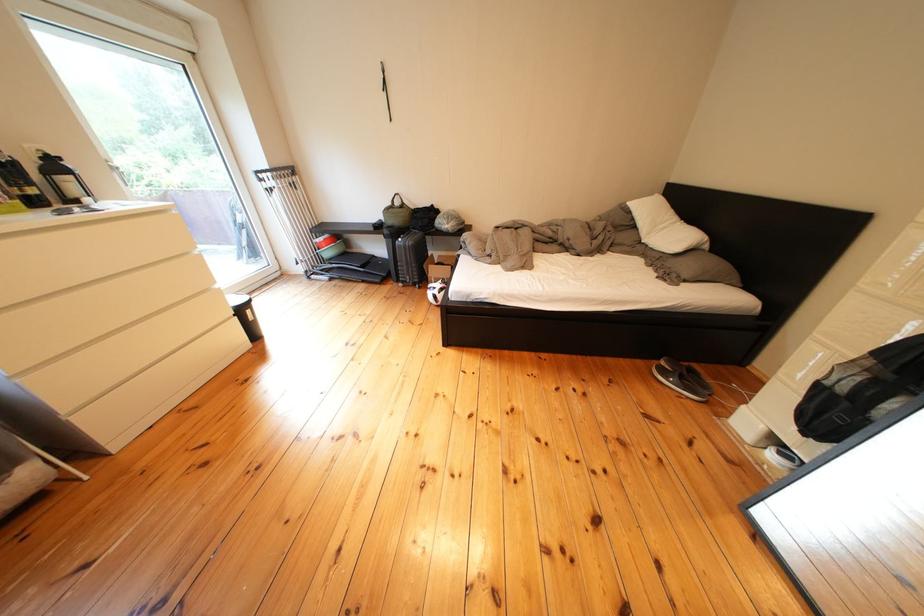
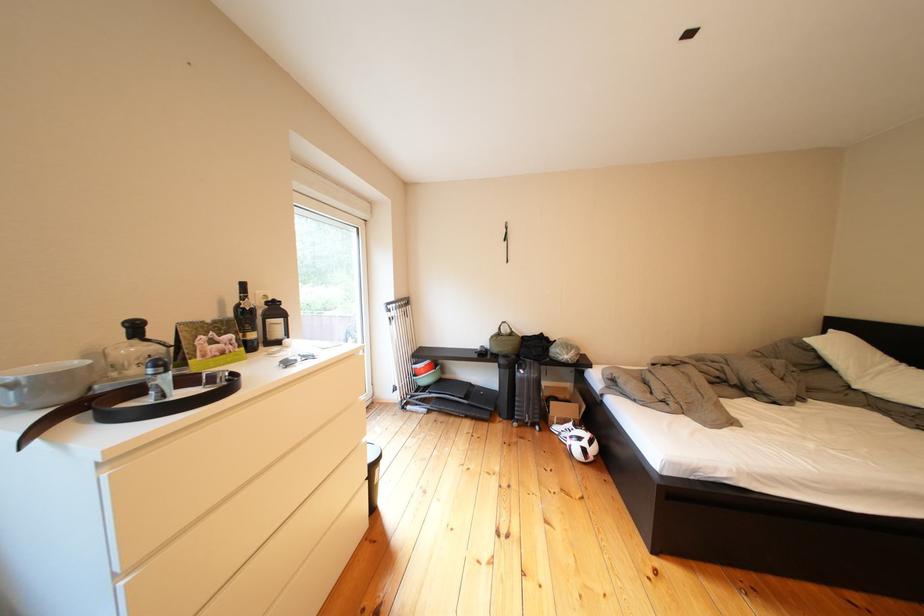
In the second image, find the point that corresponds to [407,206] in the first image.

(514, 334)